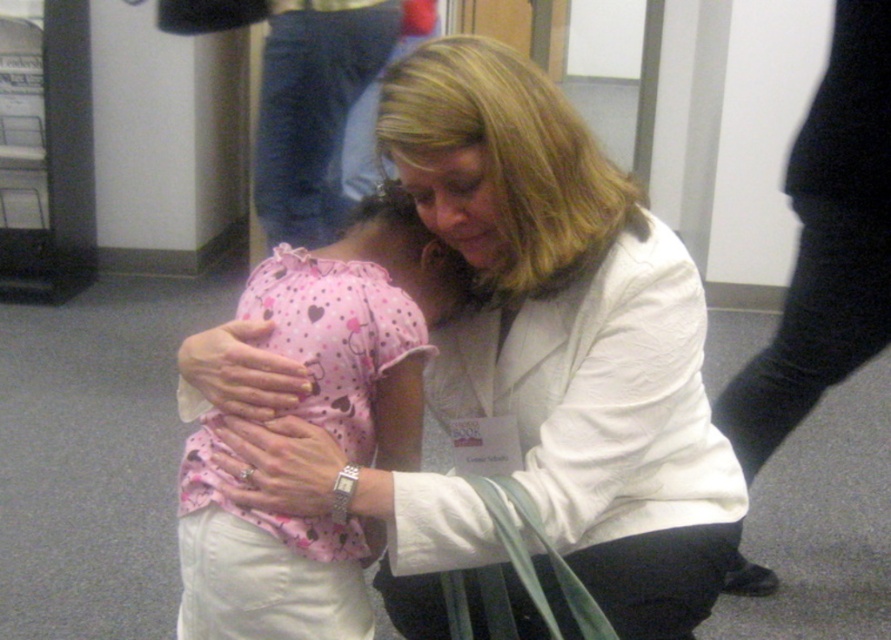
Question: Among these points, which one is farthest from the camera?

Choices:
 (A) (685, 340)
 (B) (345, 413)

Answer: (A)

Question: Can you confirm if white smooth coat at center is thinner than pink dotted fabric at center?

Choices:
 (A) no
 (B) yes

Answer: (A)

Question: Which point is closer to the camera?

Choices:
 (A) white smooth coat at center
 (B) pink dotted fabric at center

Answer: (A)

Question: Does white smooth coat at center have a greater width compared to pink dotted fabric at center?

Choices:
 (A) no
 (B) yes

Answer: (B)

Question: Which of the following is the farthest from the observer?

Choices:
 (A) white smooth coat at center
 (B) pink dotted fabric at center

Answer: (B)

Question: From the image, what is the correct spatial relationship of white smooth coat at center in relation to pink dotted fabric at center?

Choices:
 (A) above
 (B) below

Answer: (A)